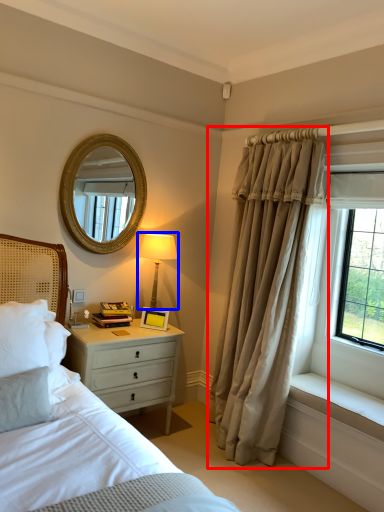
Question: Which object appears farthest to the camera in this image, curtain (highlighted by a red box) or bedside lamp (highlighted by a blue box)?

Choices:
 (A) curtain
 (B) bedside lamp

Answer: (B)